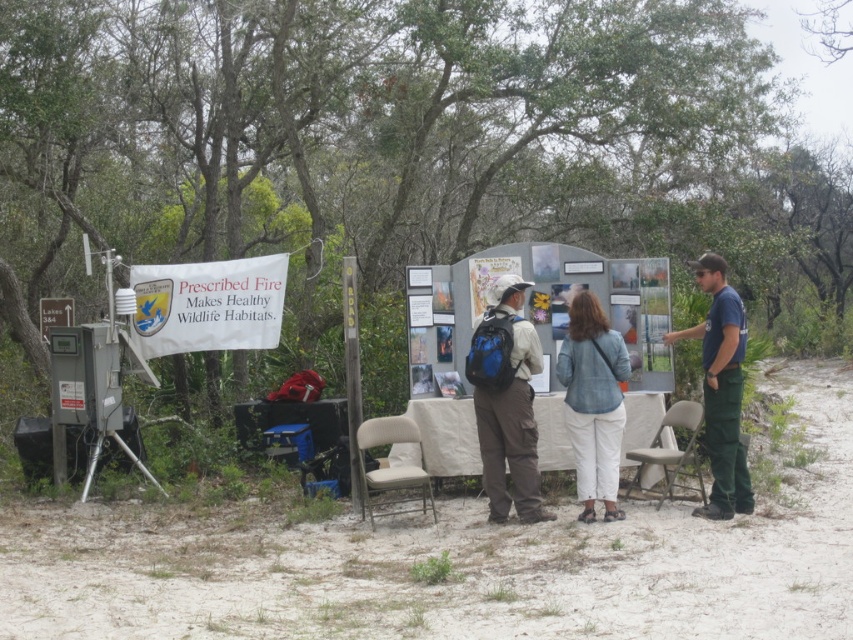
Question: Is dirt field at lower center bigger than khaki fabric pants at center?

Choices:
 (A) no
 (B) yes

Answer: (B)

Question: Which of these objects is positioned closest to the dirt field at lower center?

Choices:
 (A) khaki fabric pants at center
 (B) denim jacket at center

Answer: (A)

Question: Is dirt field at lower center bigger than khaki fabric pants at center?

Choices:
 (A) yes
 (B) no

Answer: (A)

Question: Is denim jacket at center below dark blue uniform at center?

Choices:
 (A) yes
 (B) no

Answer: (A)

Question: Which of the following is the farthest from the observer?

Choices:
 (A) khaki fabric pants at center
 (B) dirt field at lower center
 (C) dark blue uniform at center

Answer: (C)

Question: Which of the following is the closest to the observer?

Choices:
 (A) (556, 362)
 (B) (500, 432)

Answer: (B)